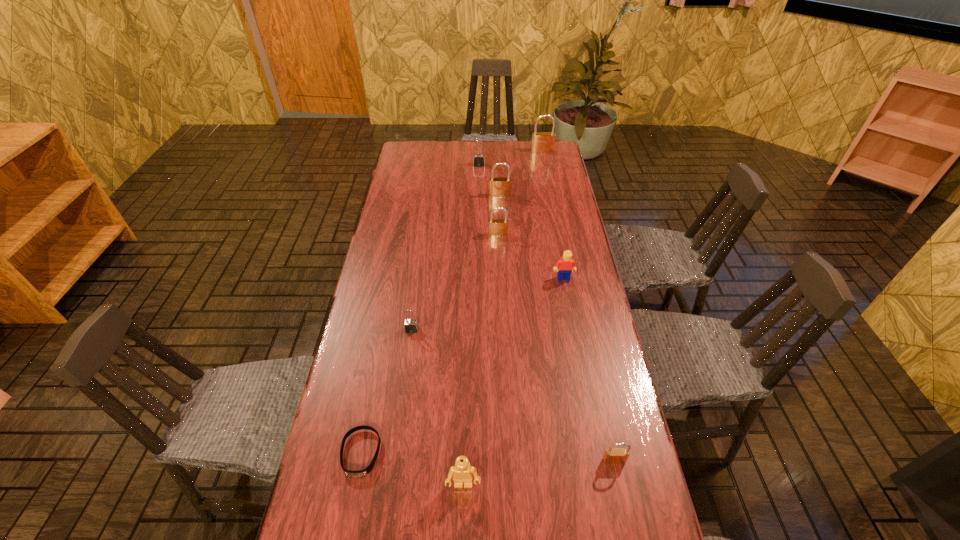
Where is `blank space located 0.260m on the front-facing side of the second smallest brass padlock`? The height and width of the screenshot is (540, 960). blank space located 0.260m on the front-facing side of the second smallest brass padlock is located at coordinates (500, 287).

Locate an element on the screen. vacant position located 0.170m on the face of the fifth nearest object is located at coordinates (571, 321).

Locate an element on the screen. Image resolution: width=960 pixels, height=540 pixels. free location located 0.060m on the face of the nearer Lego is located at coordinates (463, 524).

Identify the location of free space located 0.180m on the shackle of the second nearest padlock. The height and width of the screenshot is (540, 960). (404, 387).

Identify the location of vacant region located on the front-facing side of the smallest brass padlock. The width and height of the screenshot is (960, 540). (625, 510).

This screenshot has width=960, height=540. What are the coordinates of `padlock that is at the left edge` in the screenshot? It's located at (411, 325).

Where is `wristband that is at the left edge`? wristband that is at the left edge is located at coordinates (360, 473).

Locate an element on the screen. Image resolution: width=960 pixels, height=540 pixels. Lego that is at the right edge is located at coordinates (566, 264).

Locate an element on the screen. This screenshot has width=960, height=540. object that is at the far right corner is located at coordinates (542, 142).

This screenshot has width=960, height=540. What are the coordinates of `free space at the far edge of the desktop` in the screenshot? It's located at (489, 147).